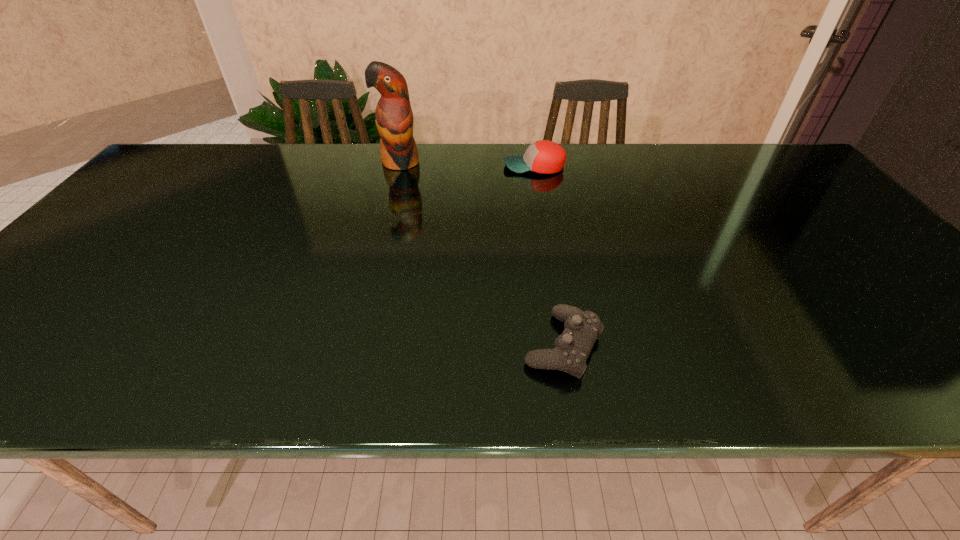
Find the location of a particular element. The width and height of the screenshot is (960, 540). parrot present at the far edge is located at coordinates (394, 119).

The height and width of the screenshot is (540, 960). What are the coordinates of `baseball cap that is positioned at the far edge` in the screenshot? It's located at (544, 156).

Image resolution: width=960 pixels, height=540 pixels. Find the location of `object positioned at the near edge`. object positioned at the near edge is located at coordinates [572, 348].

I want to click on vacant space at the far edge of the desktop, so click(x=513, y=150).

In the image, there is a desktop. Where is `free region at the near edge`? Image resolution: width=960 pixels, height=540 pixels. free region at the near edge is located at coordinates (829, 390).

This screenshot has height=540, width=960. Identify the location of free space at the left edge of the desktop. (120, 245).

Identify the location of free location at the far right corner of the desktop. (793, 180).

Locate an element on the screen. The image size is (960, 540). unoccupied position between the baseball cap and the tallest object is located at coordinates (468, 164).

I want to click on free space between the baseball cap and the shortest object, so click(x=548, y=255).

Identify the location of blank region between the tallest object and the nearest object. (482, 254).